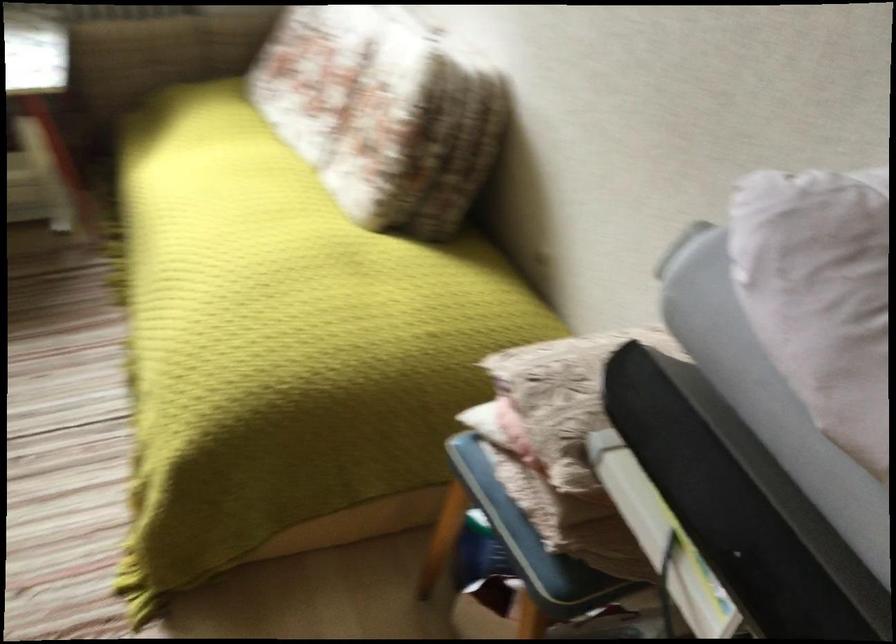
Where is `sofa sitting surface`? This screenshot has width=896, height=644. sofa sitting surface is located at coordinates (290, 314).